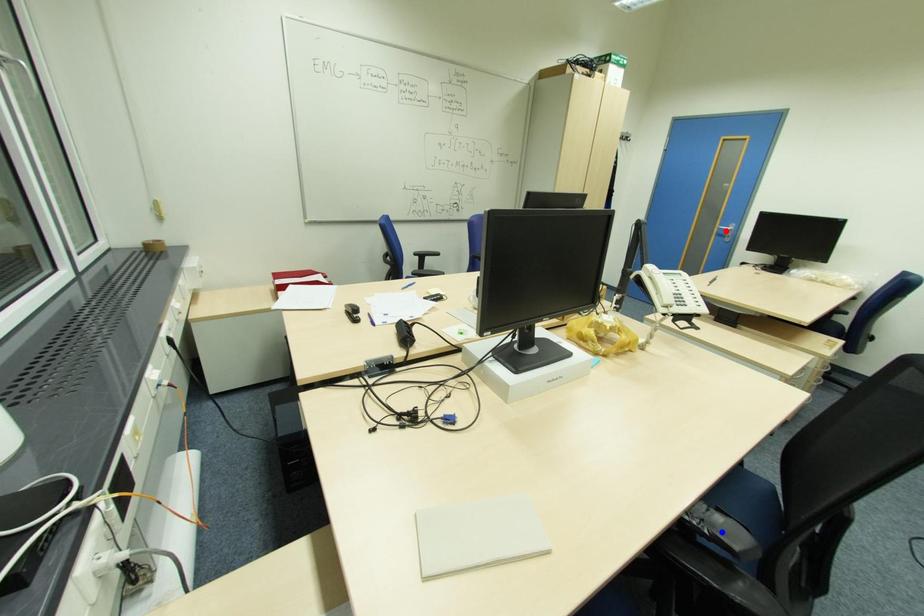
Question: Two points are marked on the image. Which point is closer to the camera?

Choices:
 (A) Blue point is closer.
 (B) Red point is closer.

Answer: (A)